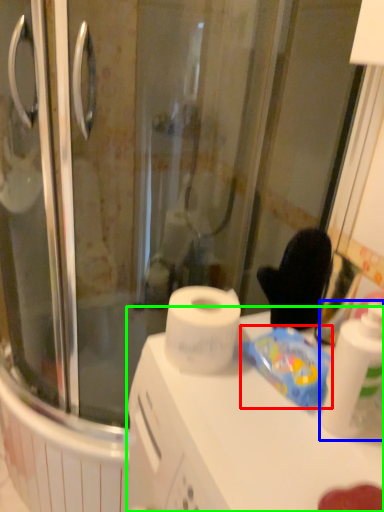
Question: Which is nearer to the food (highlighted by a red box)? cleaning product (highlighted by a blue box) or counter top (highlighted by a green box).

Choices:
 (A) cleaning product
 (B) counter top

Answer: (A)